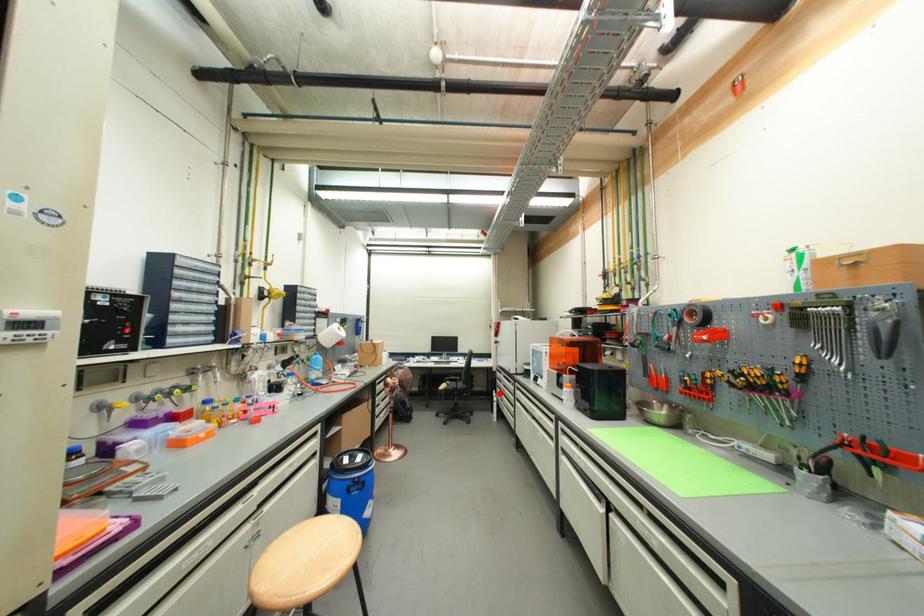
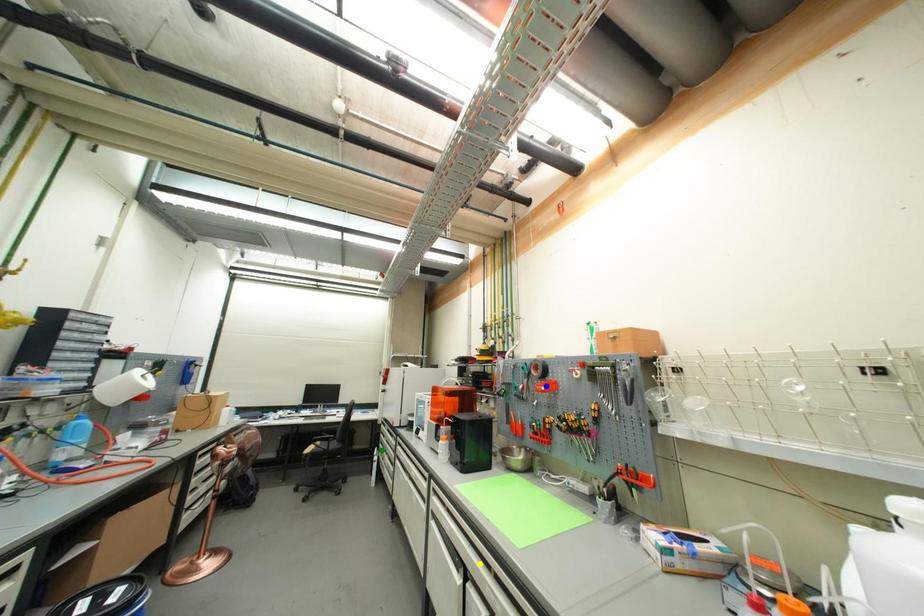
Question: I am providing you with two images of the same scene from different viewpoints. A red point is marked on the first image. You are given multiple points on the second image. Can you choose the point in image 2 that corresponds to the point in image 1?

Choices:
 (A) blue point
 (B) green point
 (C) yellow point

Answer: (B)